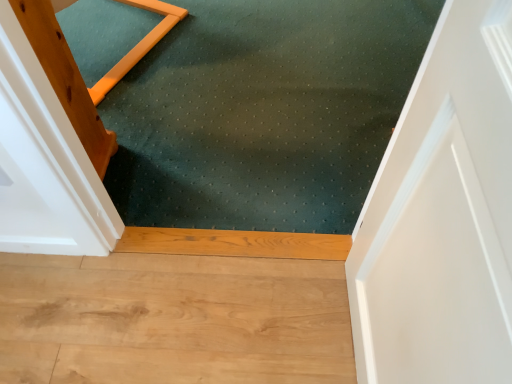
Question: Is light brown wood flooring at lower center inside or outside of green textured mat at center?

Choices:
 (A) outside
 (B) inside

Answer: (A)

Question: In the image, is light brown wood flooring at lower center positioned in front of or behind green textured mat at center?

Choices:
 (A) front
 (B) behind

Answer: (A)

Question: In terms of size, does light brown wood flooring at lower center appear bigger or smaller than green textured mat at center?

Choices:
 (A) small
 (B) big

Answer: (A)

Question: Is point (231, 215) closer or farther from the camera than point (192, 327)?

Choices:
 (A) closer
 (B) farther

Answer: (B)

Question: Is green textured mat at center taller or shorter than light brown wood flooring at lower center?

Choices:
 (A) tall
 (B) short

Answer: (B)

Question: In the image, is green textured mat at center positioned in front of or behind light brown wood flooring at lower center?

Choices:
 (A) front
 (B) behind

Answer: (B)

Question: From a real-world perspective, is green textured mat at center positioned above or below light brown wood flooring at lower center?

Choices:
 (A) above
 (B) below

Answer: (A)